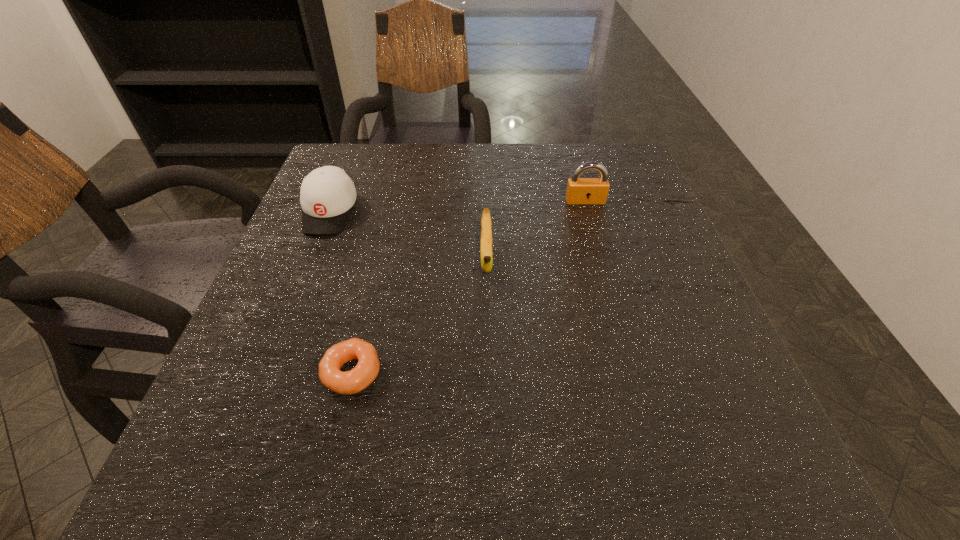
You are a GUI agent. You are given a task and a screenshot of the screen. Output one action in this format:
    pyautogui.click(x=<x>, y=<y>)
    Task: Click on the baseball cap that is at the left edge
    Image resolution: width=960 pixels, height=540 pixels.
    Given the screenshot: What is the action you would take?
    pyautogui.click(x=327, y=195)

What are the coordinates of `doughnut located in the left edge section of the desktop` in the screenshot? It's located at click(x=351, y=382).

Locate an element on the screen. The image size is (960, 540). object present at the right edge is located at coordinates (580, 191).

Where is `object that is at the far left corner`? The height and width of the screenshot is (540, 960). object that is at the far left corner is located at coordinates (327, 195).

The height and width of the screenshot is (540, 960). What are the coordinates of `free space at the far edge` in the screenshot? It's located at (397, 190).

At what (x,y) coordinates should I click in order to perform the action: click on vacant space at the near edge. Please return your answer as a coordinate pair (x, y). The height and width of the screenshot is (540, 960). Looking at the image, I should click on (637, 461).

The height and width of the screenshot is (540, 960). I want to click on blank space at the left edge, so click(x=278, y=316).

You are a GUI agent. You are given a task and a screenshot of the screen. Output one action in this format:
    pyautogui.click(x=<x>, y=<y>)
    Task: Click on the free space at the right edge
    The height and width of the screenshot is (540, 960).
    Given the screenshot: What is the action you would take?
    pyautogui.click(x=641, y=195)

The height and width of the screenshot is (540, 960). Identify the location of free region at the near left corner. (232, 464).

Find the location of a particular element. vacant region between the third object from right to left and the baseball cap is located at coordinates (341, 292).